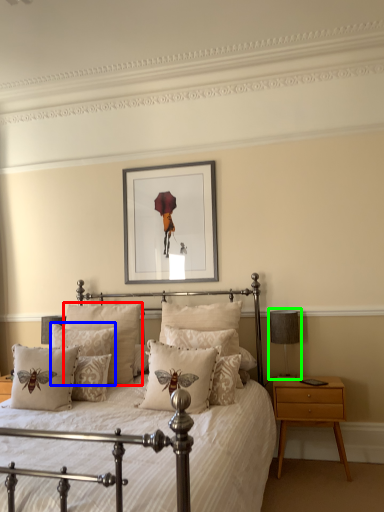
Question: Which is farther away from pillow (highlighted by a red box)? pillow (highlighted by a blue box) or table lamp (highlighted by a green box)?

Choices:
 (A) pillow
 (B) table lamp

Answer: (B)